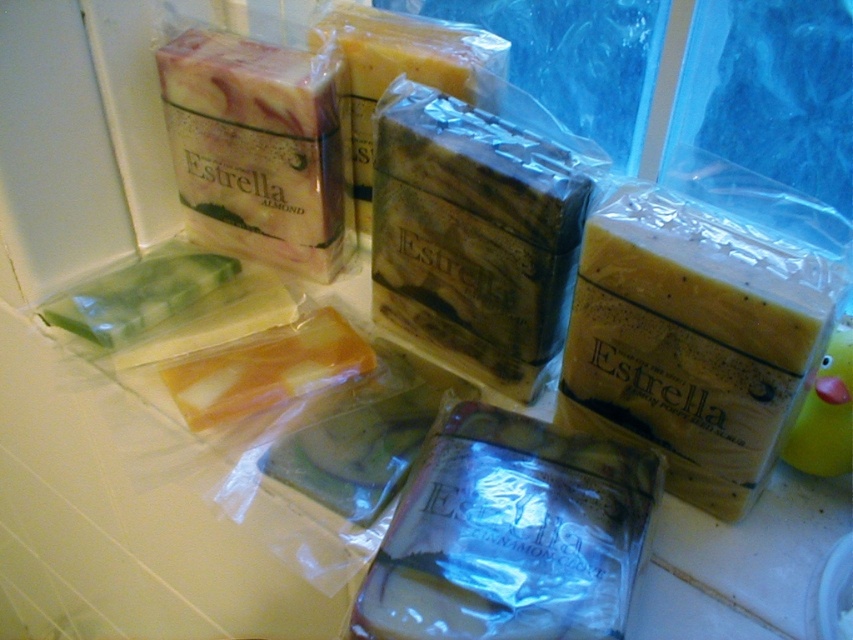
Describe the element at coordinates (695, 339) in the screenshot. I see `yellow matte soap at center` at that location.

This screenshot has width=853, height=640. Find the location of `yellow matte soap at center`. yellow matte soap at center is located at coordinates (695, 339).